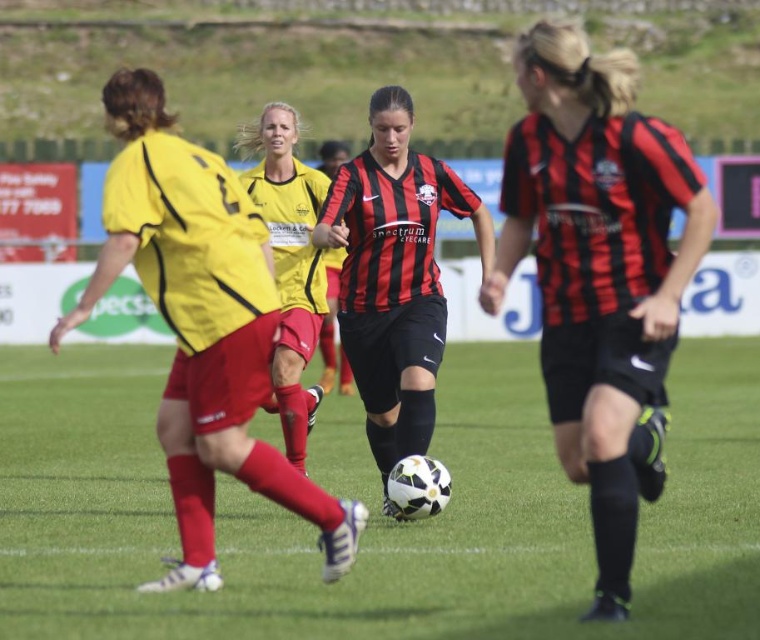
Question: Considering the relative positions of black matte soccer ball at center and yellow jersey at center in the image provided, where is black matte soccer ball at center located with respect to yellow jersey at center?

Choices:
 (A) above
 (B) below

Answer: (B)

Question: Is green grass football field at center positioned behind yellow matte jersey at center?

Choices:
 (A) no
 (B) yes

Answer: (A)

Question: Which of the following is the closest to the observer?

Choices:
 (A) (223, 227)
 (B) (323, 220)
 (C) (280, 416)
 (D) (622, 595)

Answer: (D)

Question: Among these points, which one is farthest from the camera?

Choices:
 (A) (122, 161)
 (B) (369, 106)

Answer: (B)

Question: Which of the following is the closest to the observer?

Choices:
 (A) yellow jersey at center
 (B) yellow matte jersey at center
 (C) matte black shorts at center
 (D) green grass football field at center

Answer: (C)

Question: Can you confirm if matte black shorts at center is positioned to the right of yellow matte jersey at center?

Choices:
 (A) yes
 (B) no

Answer: (A)